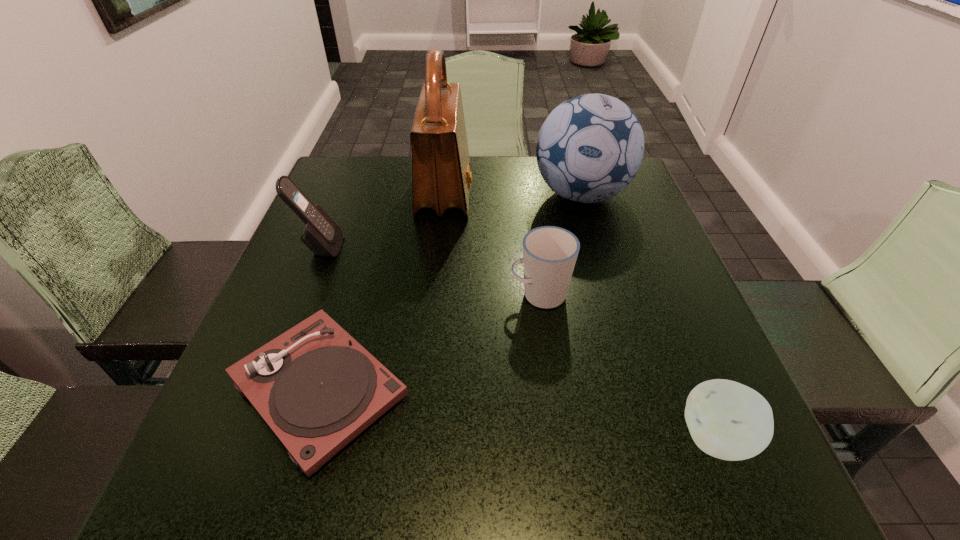
In the image, there is a desktop. Where is `vacant space at the right edge`? Image resolution: width=960 pixels, height=540 pixels. vacant space at the right edge is located at coordinates (609, 241).

In the image, there is a desktop. Where is `blank space at the near left corner`? The image size is (960, 540). blank space at the near left corner is located at coordinates (208, 474).

In order to click on free spot between the tallest object and the apple in this screenshot , I will do `click(581, 315)`.

You are a GUI agent. You are given a task and a screenshot of the screen. Output one action in this format:
    pyautogui.click(x=<x>, y=<y>)
    Task: Click on the vacant area that lies between the cup and the fourth shortest object
    The image size is (960, 540).
    Given the screenshot: What is the action you would take?
    pyautogui.click(x=430, y=271)

Where is `vacant area that lies between the fifth shortest object and the cellular telephone`? vacant area that lies between the fifth shortest object and the cellular telephone is located at coordinates (450, 221).

Find the location of a particular element. The image size is (960, 540). free spot between the shortest object and the tallest object is located at coordinates (382, 291).

Where is `vacant area that lies between the shoulder bag and the third shortest object`? The width and height of the screenshot is (960, 540). vacant area that lies between the shoulder bag and the third shortest object is located at coordinates (492, 244).

Find the location of a particular element. free spot between the third farthest object and the shoulder bag is located at coordinates (383, 220).

Find the location of `vacant space that's between the soccer ball and the shortest object`. vacant space that's between the soccer ball and the shortest object is located at coordinates (450, 292).

This screenshot has height=540, width=960. Find the location of `free spot between the fifth tallest object and the third tallest object`. free spot between the fifth tallest object and the third tallest object is located at coordinates (518, 342).